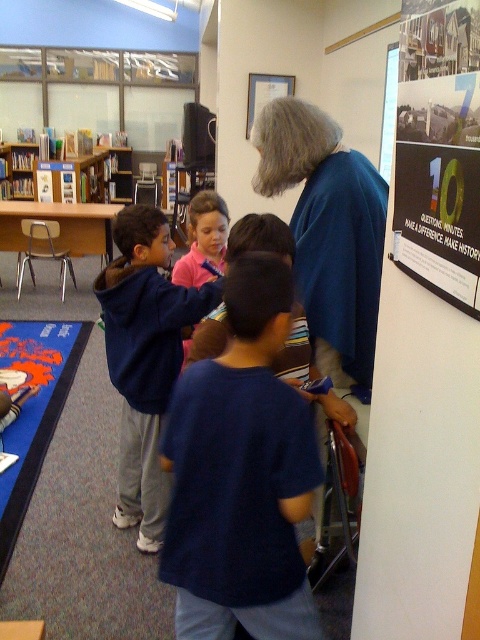
Question: Does black matte poster at upper right have a larger size compared to wooden bookshelf at upper left?

Choices:
 (A) no
 (B) yes

Answer: (A)

Question: Among these objects, which one is nearest to the camera?

Choices:
 (A) dark blue t-shirt at center
 (B) dark blue hoodie at center

Answer: (A)

Question: Can you confirm if green paper poster at upper right is positioned to the right of dark blue hoodie at center?

Choices:
 (A) yes
 (B) no

Answer: (A)

Question: Which point is farther from the camera taking this photo?

Choices:
 (A) (222, 440)
 (B) (478, 198)
 (C) (7, 177)

Answer: (C)

Question: Is green paper poster at upper right further to the viewer compared to wooden bookshelf at upper left?

Choices:
 (A) yes
 (B) no

Answer: (B)

Question: Which object is the closest to the dark blue t-shirt at center?

Choices:
 (A) black matte poster at upper right
 (B) dark blue hoodie at center

Answer: (A)